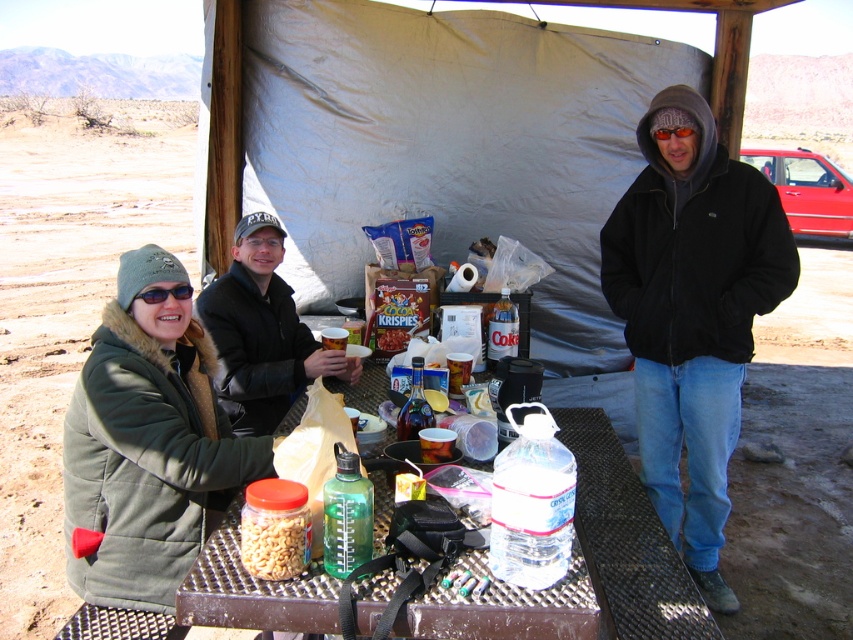
Question: Which of these objects is positioned farthest from the matte plastic jar of peanuts at center?

Choices:
 (A) translucent plastic bottle at center
 (B) metallic brown table at center

Answer: (B)

Question: Is white fabric tent at center positioned before translucent plastic bottle at center?

Choices:
 (A) yes
 (B) no

Answer: (B)

Question: Does black fleece jacket at right appear on the left side of translucent plastic bottle at center?

Choices:
 (A) yes
 (B) no

Answer: (B)

Question: Which object appears closest to the camera in this image?

Choices:
 (A) black leather jacket at center
 (B) translucent plastic bottle at center

Answer: (B)

Question: Is white fabric tent at center positioned behind matte plastic jar of peanuts at center?

Choices:
 (A) yes
 (B) no

Answer: (A)

Question: Based on their relative distances, which object is nearer to the matte plastic jar of peanuts at center?

Choices:
 (A) translucent plastic bottle at center
 (B) green fuzzy jacket at lower left
 (C) matte plastic cereal box at center
 (D) black fleece jacket at right

Answer: (B)